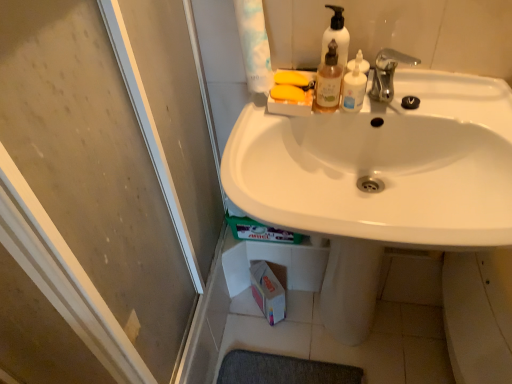
Find the location of a particular element. free spot below white glossy sink at center (from a real-world perspective) is located at coordinates (350, 344).